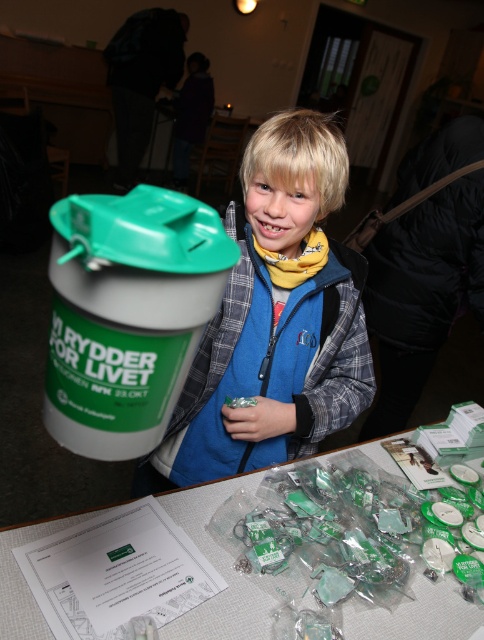
You are organizing a community event and need to place a sign on the table. The sign must be placed to the right of the blue fleece jacket at center. Is the translucent plastic table at center positioned correctly to accommodate this requirement?

Yes, the blue fleece jacket at center is to the left of the translucent plastic table at center, so placing the sign to the right of the jacket on the table would meet the requirement.

What is the exact position of the blue fleece jacket at center in the image?

The blue fleece jacket at center is located at point (274, 320).

You are a photographer at a community event. You need to place a 30 cm wide camera tripod between the blue fleece jacket at center and the translucent plastic table at center. Is there enough space for the tripod?

The distance between the blue fleece jacket at center and the translucent plastic table at center is 35.26 centimeters. Since the tripod is 30 cm wide, there is enough space to place it between them.